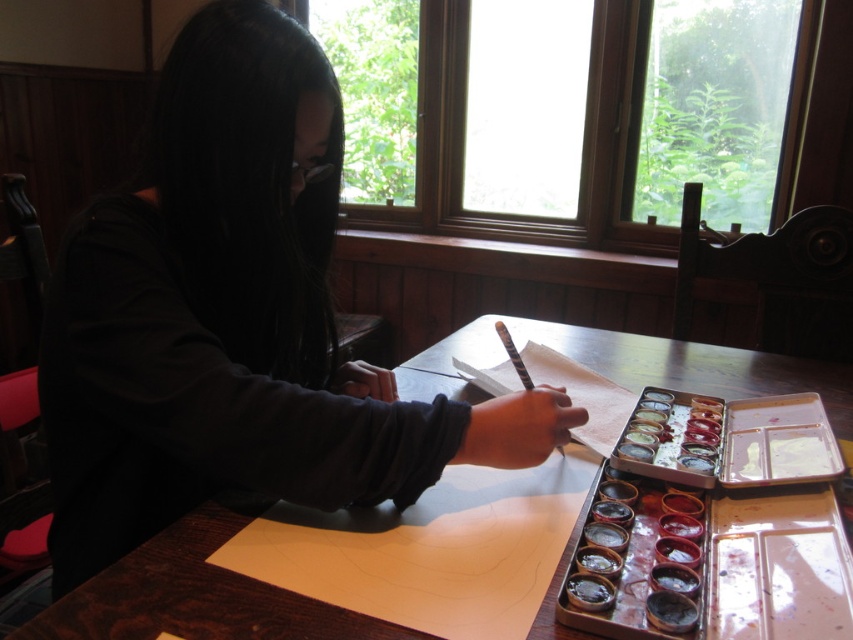
Question: Can you confirm if matte black shirt at center is positioned above wooden table at center?

Choices:
 (A) no
 (B) yes

Answer: (B)

Question: Which point is farther to the camera?

Choices:
 (A) wooden table at center
 (B) black textured paintbrush at center
 (C) matte black shirt at center

Answer: (A)

Question: Does wooden table at center lie in front of black textured paintbrush at center?

Choices:
 (A) no
 (B) yes

Answer: (A)

Question: Which point is closer to the camera taking this photo?

Choices:
 (A) (517, 369)
 (B) (119, 288)

Answer: (B)

Question: Which of the following is the closest to the observer?

Choices:
 (A) matte black shirt at center
 (B) wooden table at center
 (C) black textured paintbrush at center

Answer: (A)

Question: Is wooden table at center bigger than black textured paintbrush at center?

Choices:
 (A) no
 (B) yes

Answer: (B)